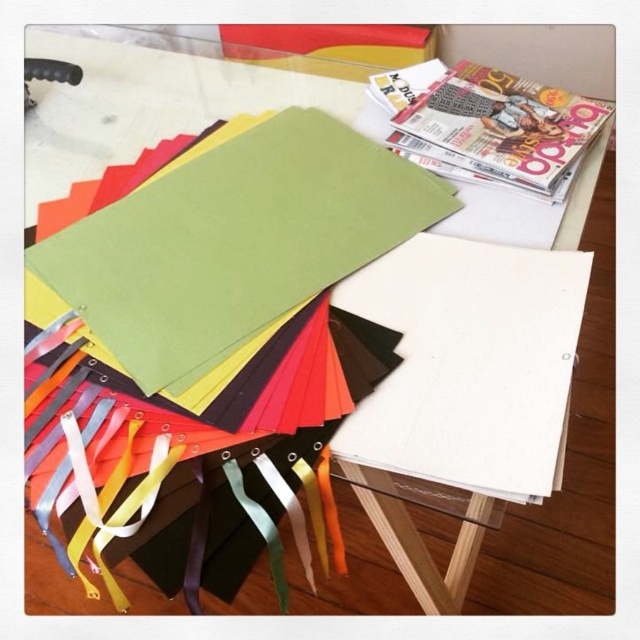
You are organizing a craft fair and need to display both the green matte paper at upper center and the matte paper magazine at upper right. Since space is limited, you want to know which item takes up more space on the table. Which one is bigger?

The green matte paper at upper center is larger in size than the matte paper magazine at upper right, so it takes up more space on the table.

You are standing at the edge of the table where the magazines are placed. You want to place a new stack of blue paper exactly where the green matte paper at upper center is located. Is the spot at point (232, 243) available? Please check the scene description and the objects description to determine if the green matte paper at upper center is already occupying that position.

The green matte paper at upper center is located at point (232, 243), so the spot is already occupied by the green matte paper at upper center. You cannot place the new stack of blue paper there.

You are standing at the edge of the table and want to place a new object on the table. The green matte paper at upper center is located at coordinates point 0.381, 0.364. Is there enough space to place your object here?

The green matte paper at upper center is located at point (232, 243). Since the coordinates are provided, there is space available at that exact point to place the object.